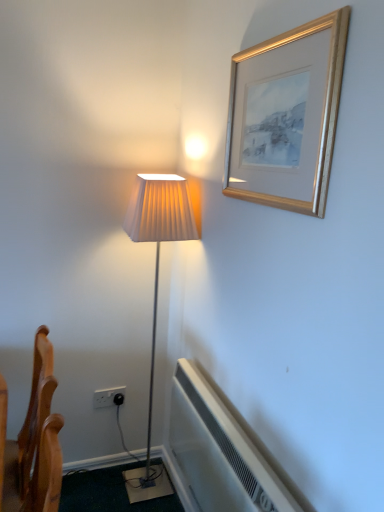
Identify the location of gold metallic picture frame at upper right. The height and width of the screenshot is (512, 384). (286, 116).

In terms of height, does gold metallic picture frame at upper right look taller or shorter compared to white plastic air conditioner at lower center?

Considering their sizes, gold metallic picture frame at upper right has more height than white plastic air conditioner at lower center.

What's the angular difference between gold metallic picture frame at upper right and white plastic air conditioner at lower center's facing directions?

There is a 0.00094-degree angle between the facing directions of gold metallic picture frame at upper right and white plastic air conditioner at lower center.

Does gold metallic picture frame at upper right appear on the left side of white plastic air conditioner at lower center?

In fact, gold metallic picture frame at upper right is to the right of white plastic air conditioner at lower center.

From a real-world perspective, which is physically below, gold metallic picture frame at upper right or white plastic air conditioner at lower center?

white plastic air conditioner at lower center is physically lower.

Measure the distance from wooden chair at lower left to gold metallic picture frame at upper right.

A distance of 37.47 inches exists between wooden chair at lower left and gold metallic picture frame at upper right.

Can you confirm if wooden chair at lower left is bigger than gold metallic picture frame at upper right?

Yes.

Which of these two, wooden chair at lower left or gold metallic picture frame at upper right, stands taller?

Standing taller between the two is wooden chair at lower left.

Does point (35, 443) appear closer or farther from the camera than point (260, 144)?

Point (35, 443) is positioned farther from the camera compared to point (260, 144).

From a real-world perspective, which is physically above, white plastic electric outlet at lower left or gold metallic picture frame at upper right?

gold metallic picture frame at upper right is physically above.

Which point is more forward, (112, 399) or (231, 150)?

The point (231, 150) is closer to the camera.

Is white plastic electric outlet at lower left with gold metallic picture frame at upper right?

white plastic electric outlet at lower left and gold metallic picture frame at upper right are clearly separated.

Between wooden chair at lower left and white plastic electric outlet at lower left, which one appears on the right side from the viewer's perspective?

white plastic electric outlet at lower left is more to the right.

Is wooden chair at lower left far away from white plastic electric outlet at lower left?

wooden chair at lower left is near white plastic electric outlet at lower left, not far away.

Does wooden chair at lower left have a lesser height compared to white plastic electric outlet at lower left?

No, wooden chair at lower left is not shorter than white plastic electric outlet at lower left.

Can you tell me how much wooden chair at lower left and white plastic electric outlet at lower left differ in facing direction?

The facing directions of wooden chair at lower left and white plastic electric outlet at lower left are 88.4 degrees apart.

In the scene shown: Which object is positioned more to the left, white plastic electric outlet at lower left or wooden chair at lower left?

From the viewer's perspective, wooden chair at lower left appears more on the left side.

Is white plastic electric outlet at lower left placed right next to wooden chair at lower left?

No, white plastic electric outlet at lower left is not next to wooden chair at lower left.

Is white plastic electric outlet at lower left in front of or behind wooden chair at lower left in the image?

white plastic electric outlet at lower left is positioned farther from the viewer than wooden chair at lower left.

Does point (96, 391) lie in front of point (37, 444)?

No.

Is gold metallic picture frame at upper right behind wooden chair at lower left?

No, gold metallic picture frame at upper right is in front of wooden chair at lower left.

Consider the image. From the image's perspective, which is above, gold metallic picture frame at upper right or wooden chair at lower left?

From the image's view, gold metallic picture frame at upper right is above.

Find the location of `picture frame on the right side of wooden chair at lower left`. picture frame on the right side of wooden chair at lower left is located at coordinates (286, 116).

Would you say gold metallic picture frame at upper right is outside wooden chair at lower left?

Yes, gold metallic picture frame at upper right is outside of wooden chair at lower left.

Which of these two, white plastic air conditioner at lower center or white plastic electric outlet at lower left, is thinner?

white plastic electric outlet at lower left.

Considering the positions of objects white plastic air conditioner at lower center and white plastic electric outlet at lower left in the image provided, who is more to the right, white plastic air conditioner at lower center or white plastic electric outlet at lower left?

white plastic air conditioner at lower center is more to the right.

Is white plastic air conditioner at lower center not within white plastic electric outlet at lower left?

That's correct, white plastic air conditioner at lower center is outside of white plastic electric outlet at lower left.

Can you confirm if white plastic air conditioner at lower center is shorter than white plastic electric outlet at lower left?

No, white plastic air conditioner at lower center is not shorter than white plastic electric outlet at lower left.

Locate an element on the screen. air conditioner directly beneath the gold metallic picture frame at upper right (from a real-world perspective) is located at coordinates (223, 451).

Find the location of `furniture behind the gold metallic picture frame at upper right`. furniture behind the gold metallic picture frame at upper right is located at coordinates (33, 442).

Considering their positions, is wooden chair at lower left positioned further to white plastic air conditioner at lower center than gold metallic picture frame at upper right?

gold metallic picture frame at upper right.

From the image, which object appears to be farther from white plastic electric outlet at lower left, white plastic air conditioner at lower center or wooden chair at lower left?

white plastic air conditioner at lower center is further to white plastic electric outlet at lower left.

Based on their spatial positions, is white plastic air conditioner at lower center or white plastic electric outlet at lower left further from gold metallic picture frame at upper right?

white plastic electric outlet at lower left is positioned further to the anchor gold metallic picture frame at upper right.

From the image, which object appears to be nearer to white plastic air conditioner at lower center, gold metallic picture frame at upper right or wooden chair at lower left?

The object closer to white plastic air conditioner at lower center is wooden chair at lower left.

Considering their positions, is white plastic electric outlet at lower left positioned further to wooden chair at lower left than white plastic air conditioner at lower center?

white plastic electric outlet at lower left is positioned further to the anchor wooden chair at lower left.

Estimate the real-world distances between objects in this image. Which object is closer to gold metallic picture frame at upper right, wooden chair at lower left or white plastic air conditioner at lower center?

white plastic air conditioner at lower center is closer to gold metallic picture frame at upper right.

From the image, which object appears to be farther from gold metallic picture frame at upper right, white plastic electric outlet at lower left or white plastic air conditioner at lower center?

white plastic electric outlet at lower left lies further to gold metallic picture frame at upper right than the other object.

Considering their positions, is wooden chair at lower left positioned closer to gold metallic picture frame at upper right than white plastic electric outlet at lower left?

wooden chair at lower left is closer to gold metallic picture frame at upper right.

Locate an element on the screen. This screenshot has height=512, width=384. air conditioner between gold metallic picture frame at upper right and white plastic electric outlet at lower left from front to back is located at coordinates (223, 451).

This screenshot has height=512, width=384. Identify the location of furniture between gold metallic picture frame at upper right and white plastic air conditioner at lower center in the up-down direction. (33, 442).

Locate an element on the screen. The height and width of the screenshot is (512, 384). furniture positioned between gold metallic picture frame at upper right and white plastic electric outlet at lower left from near to far is located at coordinates (33, 442).

This screenshot has width=384, height=512. What are the coordinates of `furniture positioned between white plastic air conditioner at lower center and white plastic electric outlet at lower left from near to far` in the screenshot? It's located at (33, 442).